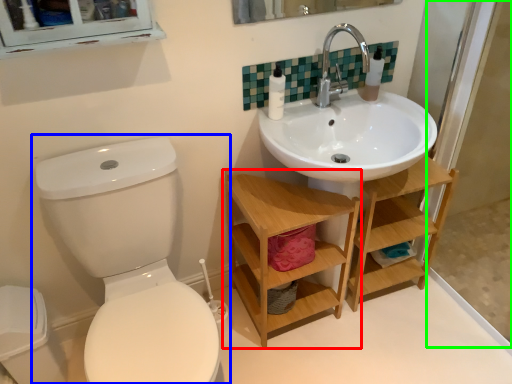
Question: Based on their relative distances, which object is farther from shelf (highlighted by a red box)? Choose from toilet (highlighted by a blue box) and screen door (highlighted by a green box).

Choices:
 (A) toilet
 (B) screen door

Answer: (B)